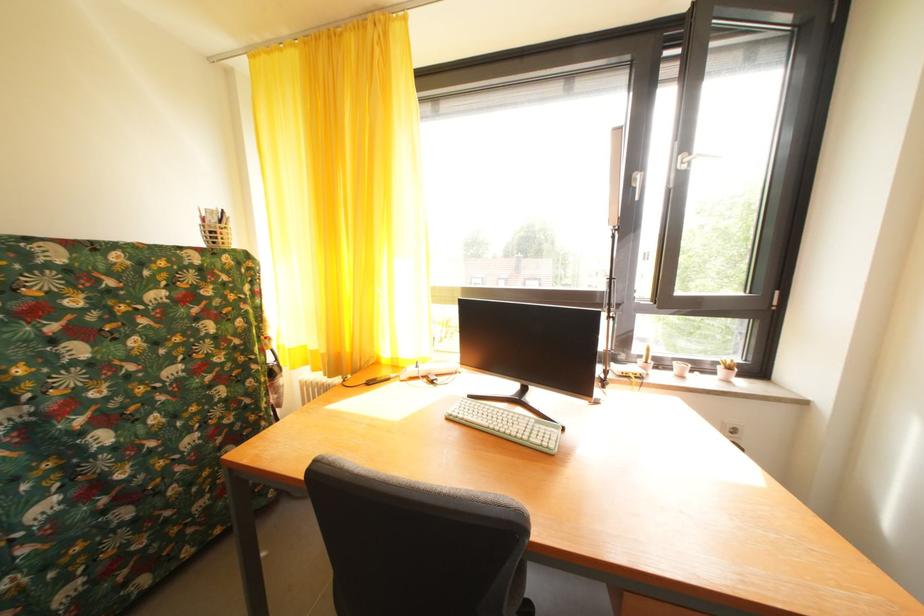
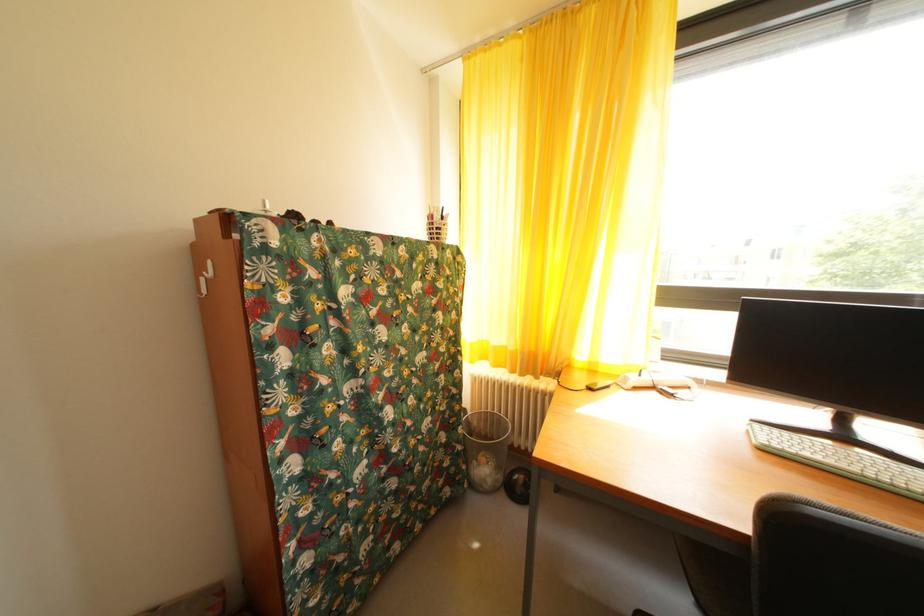
In the second image, find the point that corresponds to [322,359] in the first image.

(505, 354)